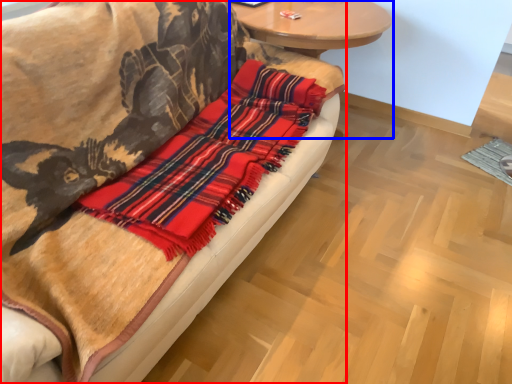
Question: Which object appears farthest to the camera in this image, studio couch (highlighted by a red box) or round table (highlighted by a blue box)?

Choices:
 (A) studio couch
 (B) round table

Answer: (B)